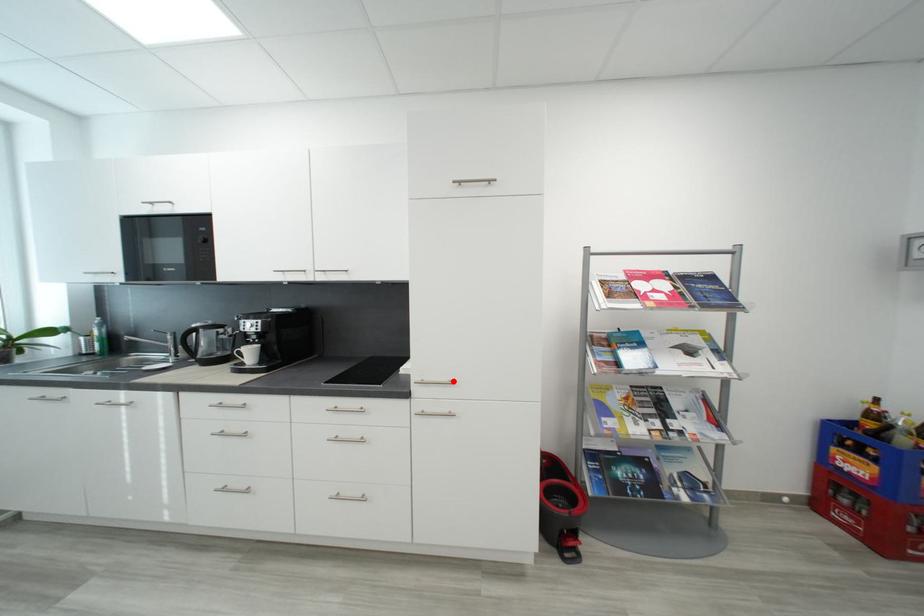
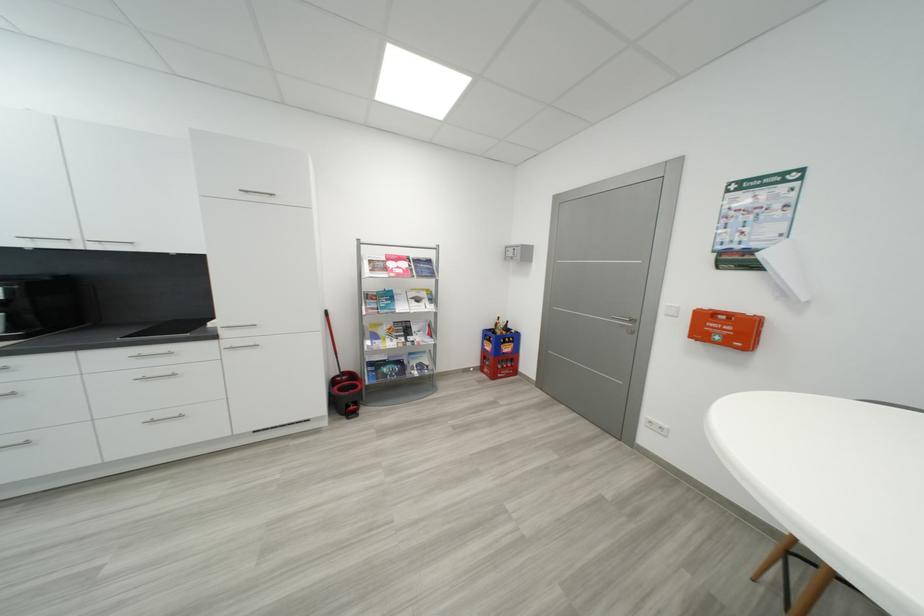
Find the pixel in the second image that matches the highlighted location in the first image.

(256, 325)